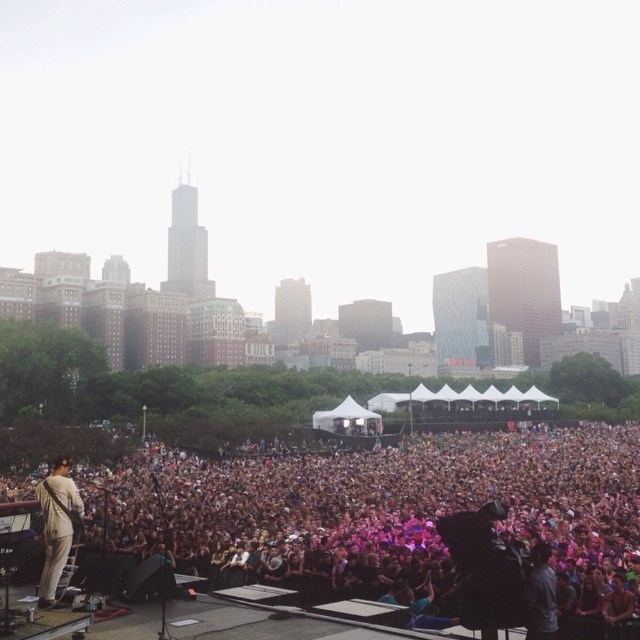
Question: Which of the following is the farthest from the observer?

Choices:
 (A) pyautogui.click(x=589, y=452)
 (B) pyautogui.click(x=60, y=502)

Answer: (A)

Question: Which point is closer to the camera?

Choices:
 (A) light beige suit at center
 (B) pink fabric crowd at center

Answer: (B)

Question: From the image, what is the correct spatial relationship of pink fabric crowd at center in relation to light beige suit at center?

Choices:
 (A) right
 (B) left

Answer: (A)

Question: Is pink fabric crowd at center smaller than light beige suit at center?

Choices:
 (A) no
 (B) yes

Answer: (A)

Question: Does pink fabric crowd at center come behind light beige suit at center?

Choices:
 (A) yes
 (B) no

Answer: (B)